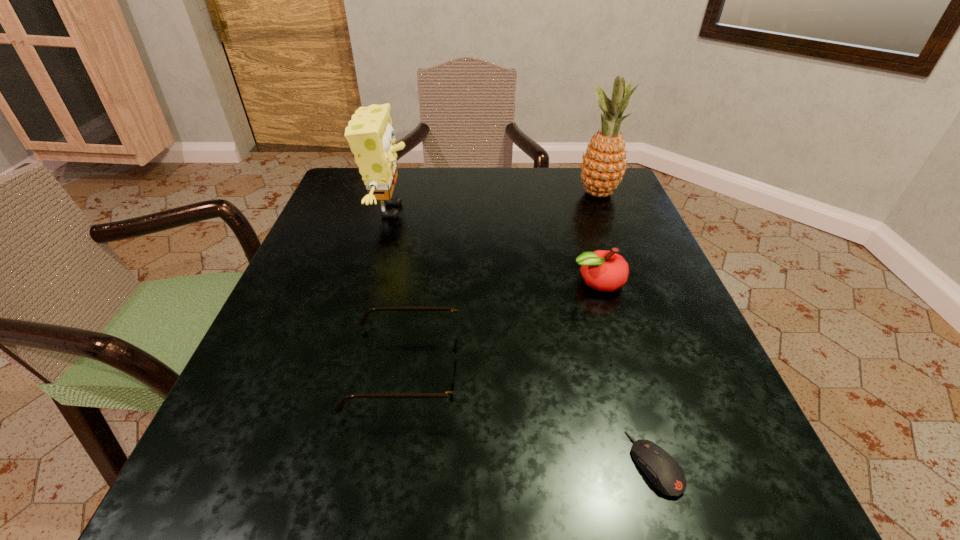
In order to click on free region at the near right corner of the desktop in this screenshot , I will do `click(700, 474)`.

Where is `free spot between the computer mouse and the spectacles`? Image resolution: width=960 pixels, height=540 pixels. free spot between the computer mouse and the spectacles is located at coordinates (530, 416).

Image resolution: width=960 pixels, height=540 pixels. I want to click on empty space that is in between the pineapple and the second tallest object, so click(x=494, y=202).

Where is `free point between the third nearest object and the second tallest object`? The height and width of the screenshot is (540, 960). free point between the third nearest object and the second tallest object is located at coordinates (493, 246).

This screenshot has height=540, width=960. Find the location of `free space between the sponge and the pineapple`. free space between the sponge and the pineapple is located at coordinates (494, 202).

Where is `free space between the third farthest object and the fourth tallest object`? The width and height of the screenshot is (960, 540). free space between the third farthest object and the fourth tallest object is located at coordinates (501, 325).

Locate an element on the screen. This screenshot has width=960, height=540. unoccupied area between the second tallest object and the third shortest object is located at coordinates (493, 246).

This screenshot has height=540, width=960. What are the coordinates of `vacant space that's between the tallest object and the shortest object` in the screenshot? It's located at (627, 328).

This screenshot has height=540, width=960. What are the coordinates of `free spot between the sponge and the second shortest object` in the screenshot? It's located at (397, 289).

I want to click on free space between the second shortest object and the second tallest object, so click(397, 289).